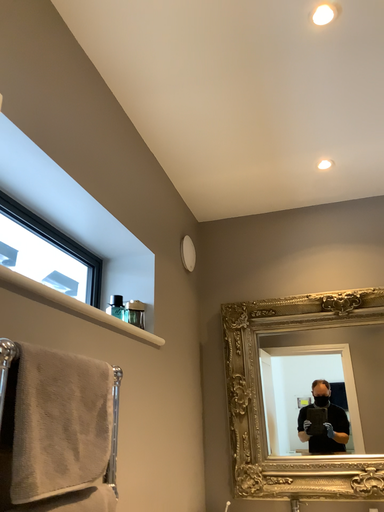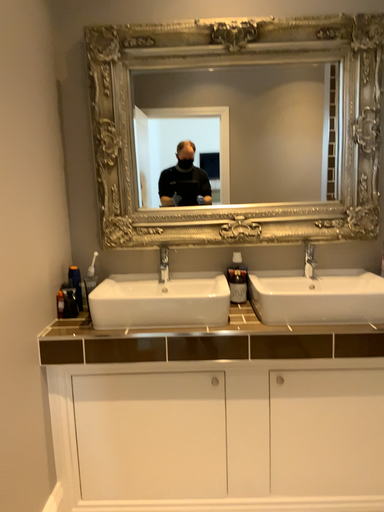
Question: Which way did the camera rotate in the video?

Choices:
 (A) rotated left
 (B) rotated right

Answer: (B)